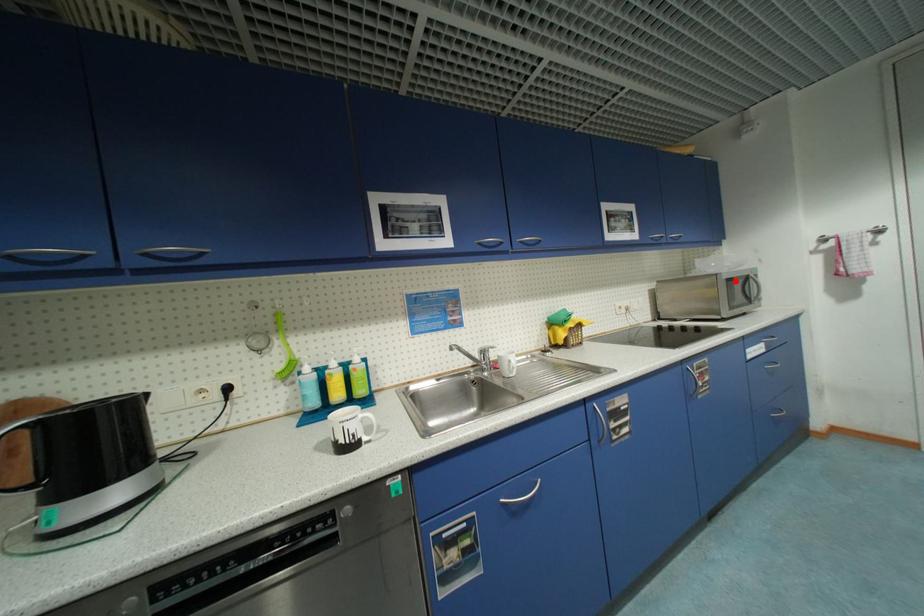
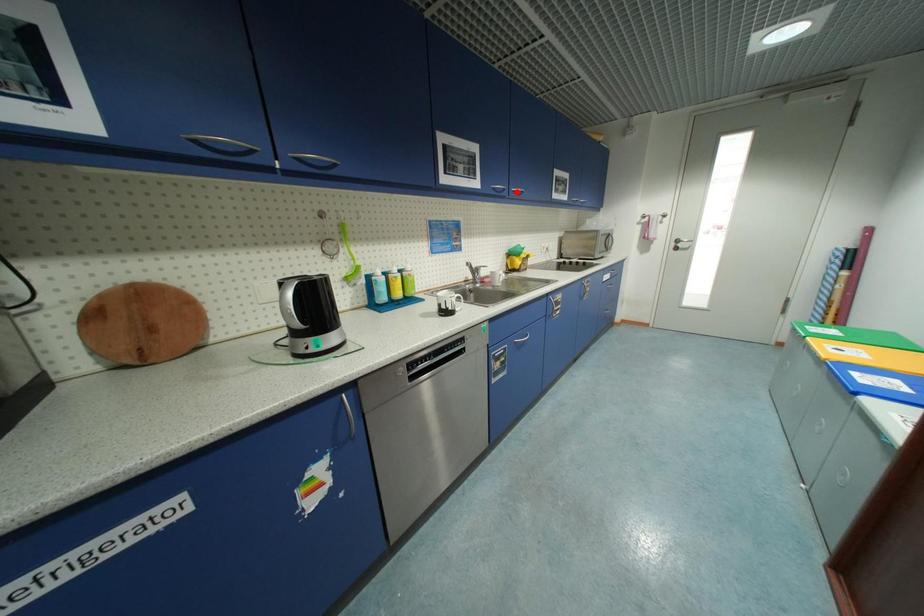
Looking at this image, I am providing you with two images of the same scene from different viewpoints. A red point is marked on the first image and another point is marked on the second image. Is the red point in image1 aligned with the point shown in image2?

No